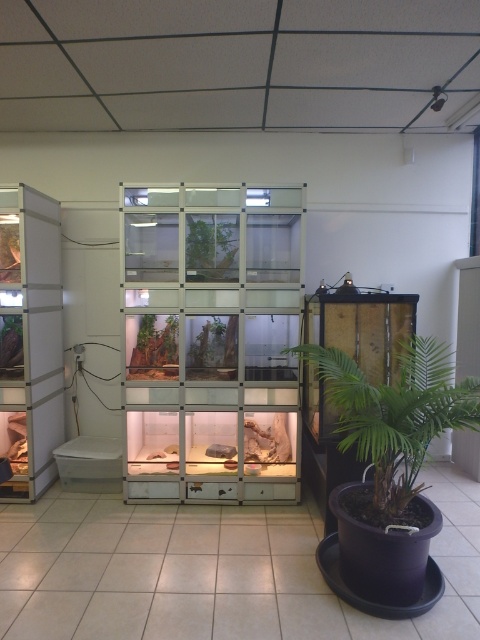
You are a zookeeper checking the plants in the terrariums. You need to water the green leafy plant at lower right and the green matte plant at center. Which plant should you water first if you want to start from the lowest position in the shelving unit?

The green leafy plant at lower right is located below the green matte plant at center, so you should water the green leafy plant at lower right first.

You are a zookeeper preparing to water the plants in the reptile exhibit. You need to water the green leafy plant at lower right and the green matte plant at center. Which plant should you water first if you want to start from the leftmost position?

The green matte plant at center is on the left side of the green leafy plant at lower right, so you should water the green matte plant at center first.

You are a zookeeper who needs to water the plants in the terrariums. You have a watering can with a 1.2 meter long extendable handle. If you are standing in front of the green leafy plant at lower right, can you reach the green matte plant at center with the extended handle?

The green leafy plant at lower right and green matte plant at center are 1.05 meters apart. Since the watering can handle is 1.2 meters long when extended, you can reach the green matte plant at center.